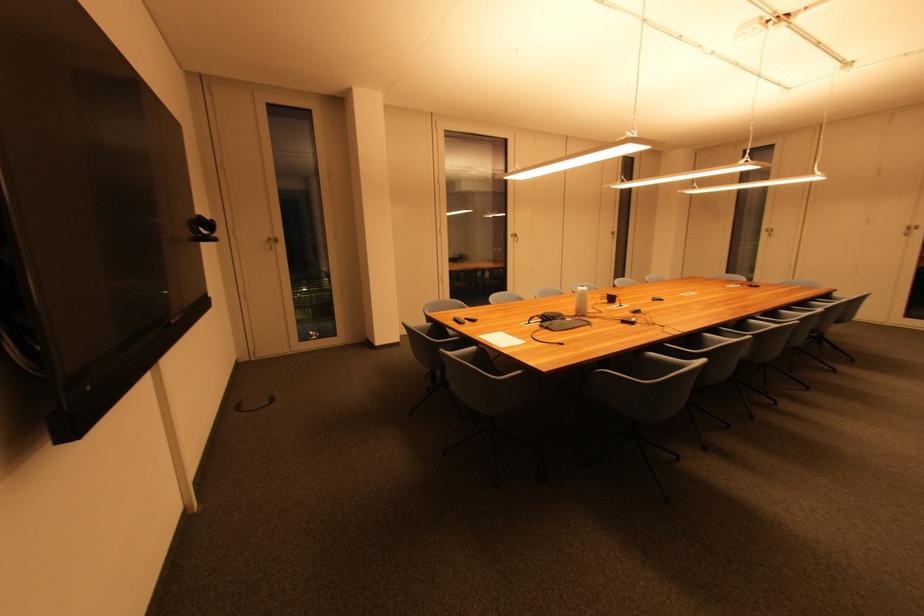
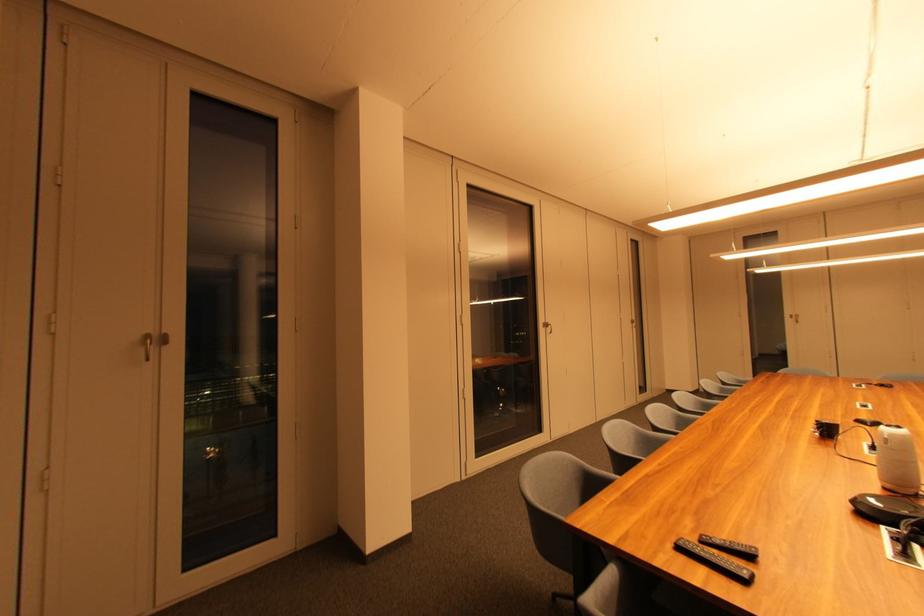
The images are taken continuously from a first-person perspective. In which direction are you moving?

The cameraman walked toward left, forward.